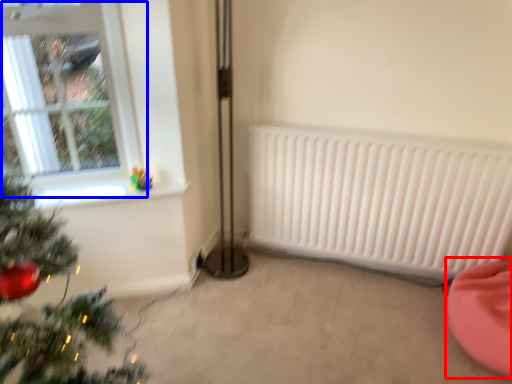
Question: Which of the following is the closest to the observer, bean bag chair (highlighted by a red box) or window (highlighted by a blue box)?

Choices:
 (A) bean bag chair
 (B) window

Answer: (A)